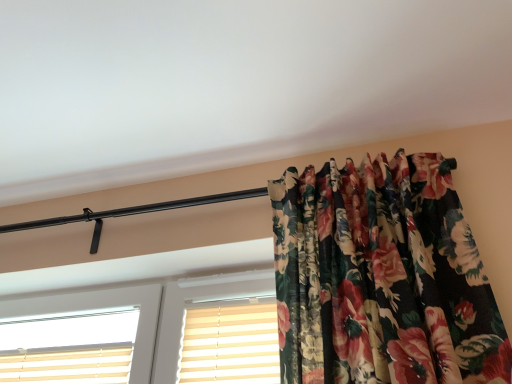
From the picture: What is the approximate height of white plastic window at center?

white plastic window at center is 16.23 inches in height.

Where is `white plastic window at center`? white plastic window at center is located at coordinates (149, 294).

What do you see at coordinates (149, 294) in the screenshot?
I see `white plastic window at center` at bounding box center [149, 294].

This screenshot has width=512, height=384. Describe the element at coordinates (230, 344) in the screenshot. I see `beige striped shutter at center` at that location.

You are a GUI agent. You are given a task and a screenshot of the screen. Output one action in this format:
    pyautogui.click(x=<x>, y=<y>)
    Task: Click on the beige striped shutter at center
    Image resolution: width=512 pixels, height=384 pixels.
    Given the screenshot: What is the action you would take?
    pyautogui.click(x=230, y=344)

Find the location of a particular element. This screenshot has height=384, width=512. white plastic window at center is located at coordinates pyautogui.click(x=149, y=294).

Would you say beige striped shutter at center is to the left or to the right of white plastic window at center in the picture?

From the image, it's evident that beige striped shutter at center is to the right of white plastic window at center.

Considering the relative positions of beige striped shutter at center and white plastic window at center in the image provided, is beige striped shutter at center behind white plastic window at center?

Yes, beige striped shutter at center is further from the camera.

Consider the image. Which point is more forward, [243,374] or [178,268]?

The point [243,374] is closer to the camera.

From the image's perspective, which one is positioned lower, beige striped shutter at center or white plastic window at center?

white plastic window at center appears lower in the image.

From a real-world perspective, is beige striped shutter at center over white plastic window at center?

Incorrect, from a real-world perspective, beige striped shutter at center is lower than white plastic window at center.

Considering the sizes of beige striped shutter at center and white plastic window at center in the image, is beige striped shutter at center wider or thinner than white plastic window at center?

beige striped shutter at center is thinner than white plastic window at center.

Is beige striped shutter at center shorter than white plastic window at center?

Indeed, beige striped shutter at center has a lesser height compared to white plastic window at center.

Which of these two, beige striped shutter at center or white plastic window at center, is bigger?

Bigger between the two is white plastic window at center.

Would you say white plastic window at center is part of beige striped shutter at center's contents?

No, white plastic window at center is not a part of beige striped shutter at center.

Is beige striped shutter at center far from white plastic window at center?

No, beige striped shutter at center is not far from white plastic window at center.

Is beige striped shutter at center oriented away from white plastic window at center?

Absolutely, beige striped shutter at center is directed away from white plastic window at center.

What are the coordinates of `shutter on the right side of white plastic window at center` in the screenshot? It's located at (230, 344).

Considering the relative positions of white plastic window at center and beige striped shutter at center in the image provided, is white plastic window at center to the left of beige striped shutter at center from the viewer's perspective?

Yes.

Is white plastic window at center further to the viewer compared to beige striped shutter at center?

No, white plastic window at center is in front of beige striped shutter at center.

Which point is more distant from viewer, (102, 300) or (201, 324)?

Point (102, 300)

From the image's perspective, would you say white plastic window at center is positioned over beige striped shutter at center?

Actually, white plastic window at center appears below beige striped shutter at center in the image.

From a real-world perspective, is white plastic window at center physically above beige striped shutter at center?

Correct, in the physical world, white plastic window at center is higher than beige striped shutter at center.

Considering the sizes of objects white plastic window at center and beige striped shutter at center in the image provided, who is wider, white plastic window at center or beige striped shutter at center?

white plastic window at center.

Which of these two, white plastic window at center or beige striped shutter at center, stands shorter?

Standing shorter between the two is beige striped shutter at center.

Is white plastic window at center bigger than beige striped shutter at center?

Yes.

Would you say white plastic window at center contains beige striped shutter at center?

Yes, white plastic window at center is surrounding beige striped shutter at center.

Is white plastic window at center placed right next to beige striped shutter at center?

No, white plastic window at center is not in contact with beige striped shutter at center.

Is white plastic window at center positioned with its back to beige striped shutter at center?

Yes.

Where is `shutter on the right of white plastic window at center`? This screenshot has width=512, height=384. shutter on the right of white plastic window at center is located at coordinates (230, 344).

This screenshot has width=512, height=384. Identify the location of shutter located on the right of white plastic window at center. pos(230,344).

This screenshot has width=512, height=384. I want to click on shutter above the white plastic window at center (from the image's perspective), so click(x=230, y=344).